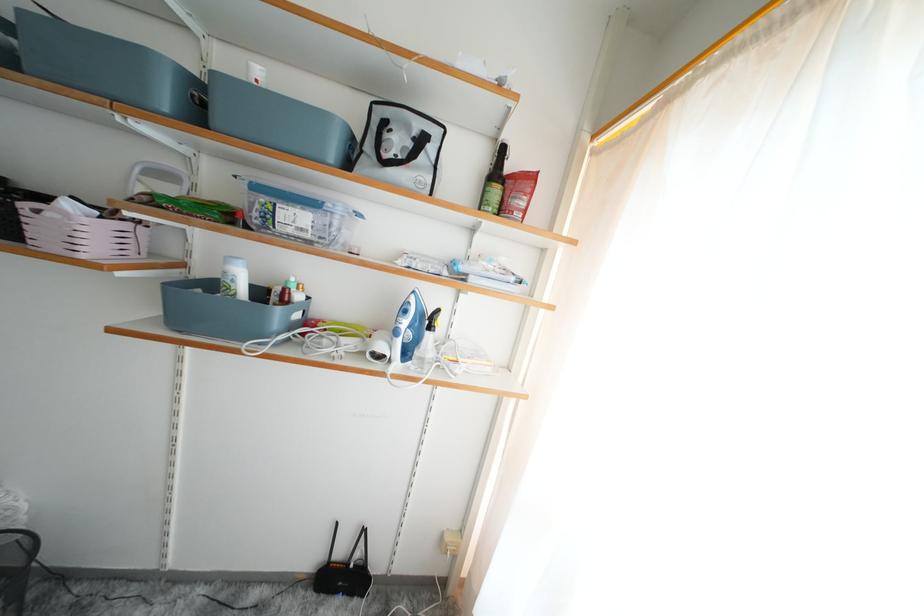
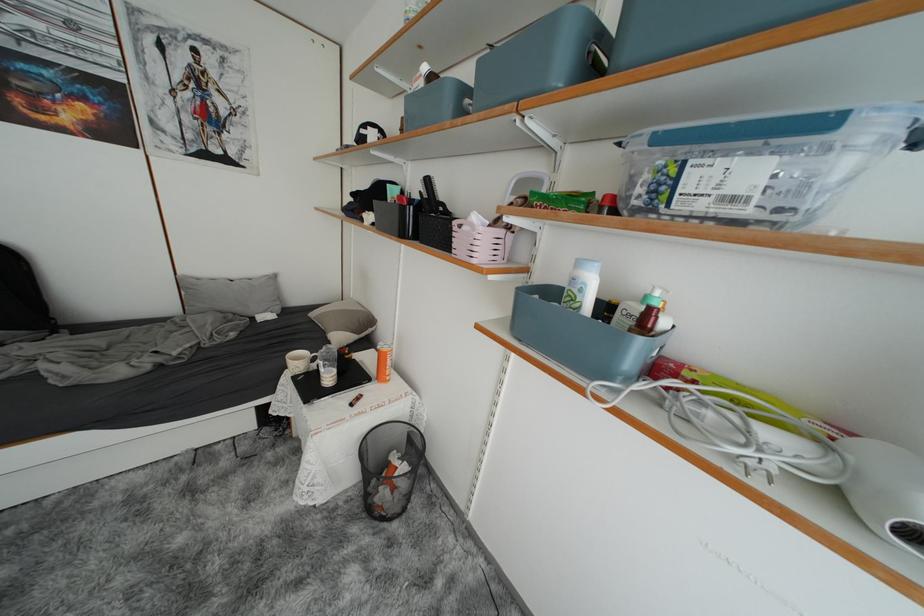
The point at [296,235] is marked in the first image. Where is the corresponding point in the second image?

(709, 209)